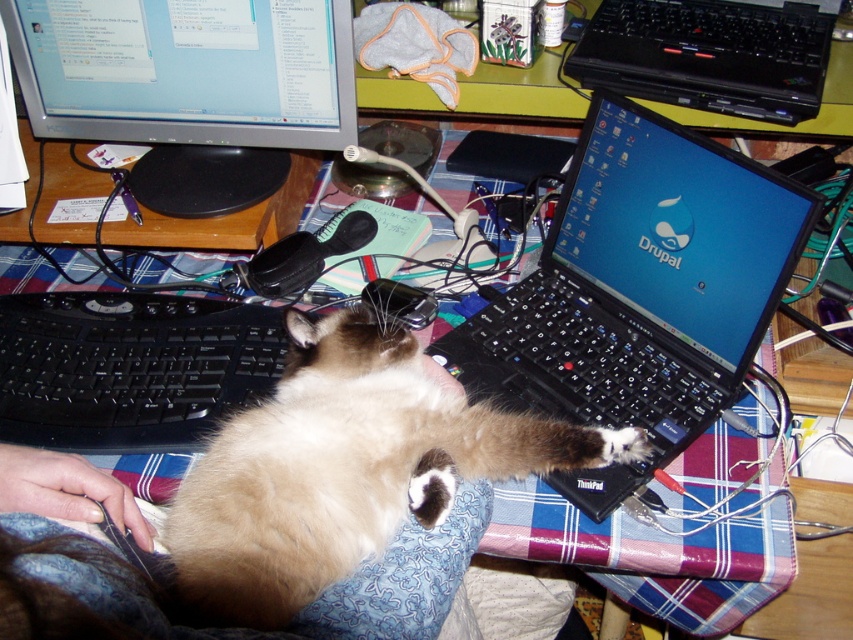
How distant is siamese fur cat at center from black plastic laptop at upper right?

siamese fur cat at center and black plastic laptop at upper right are 63.78 centimeters apart from each other.

Who is shorter, siamese fur cat at center or black plastic laptop at upper right?

With less height is black plastic laptop at upper right.

Is point (253, 433) closer to camera compared to point (682, 54)?

Yes, it is in front of point (682, 54).

Locate an element on the screen. siamese fur cat at center is located at coordinates click(x=345, y=468).

Can you confirm if silver metallic monitor at upper left is thinner than black plastic keyboard at center?

Incorrect, silver metallic monitor at upper left's width is not less than black plastic keyboard at center's.

Is silver metallic monitor at upper left bigger than black plastic keyboard at center?

Yes, silver metallic monitor at upper left is bigger than black plastic keyboard at center.

Between point (178, 17) and point (267, 385), which one is positioned in front?

Point (267, 385)

Identify the location of silver metallic monitor at upper left. (189, 88).

Is siamese fur cat at center to the right of black plastic keyboard at center from the viewer's perspective?

Yes, siamese fur cat at center is to the right of black plastic keyboard at center.

The width and height of the screenshot is (853, 640). Describe the element at coordinates (345, 468) in the screenshot. I see `siamese fur cat at center` at that location.

Image resolution: width=853 pixels, height=640 pixels. Find the location of `siamese fur cat at center`. siamese fur cat at center is located at coordinates (345, 468).